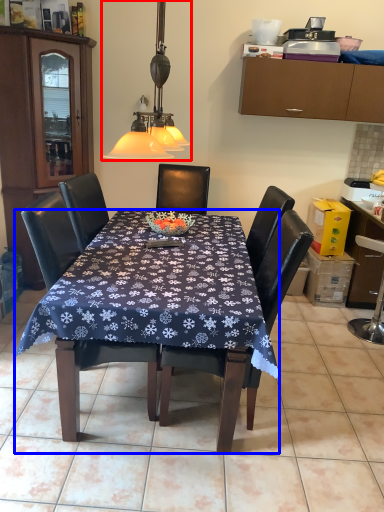
Question: Which point is closer to the camera, lamp (highlighted by a red box) or desk (highlighted by a blue box)?

Choices:
 (A) lamp
 (B) desk

Answer: (A)